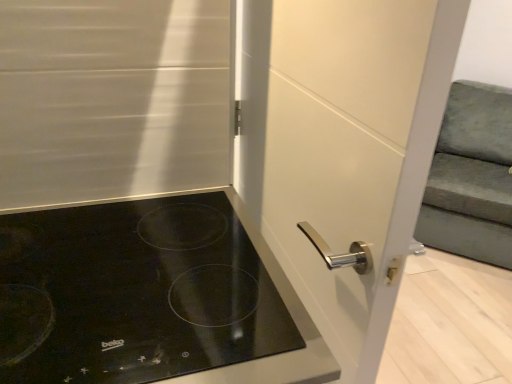
Question: Are white glossy door handle at center and velvet green armchair at right far apart?

Choices:
 (A) no
 (B) yes

Answer: (B)

Question: Considering the relative positions of white glossy door handle at center and velvet green armchair at right in the image provided, is white glossy door handle at center to the right of velvet green armchair at right from the viewer's perspective?

Choices:
 (A) no
 (B) yes

Answer: (A)

Question: Is white glossy door handle at center positioned beyond the bounds of velvet green armchair at right?

Choices:
 (A) no
 (B) yes

Answer: (B)

Question: Is white glossy door handle at center taller than velvet green armchair at right?

Choices:
 (A) no
 (B) yes

Answer: (B)

Question: Does white glossy door handle at center have a larger size compared to velvet green armchair at right?

Choices:
 (A) yes
 (B) no

Answer: (B)

Question: Is point (367, 306) positioned closer to the camera than point (506, 100)?

Choices:
 (A) closer
 (B) farther

Answer: (A)

Question: Is white glossy door handle at center to the left or to the right of velvet green armchair at right in the image?

Choices:
 (A) right
 (B) left

Answer: (B)

Question: From the image's perspective, relative to velvet green armchair at right, is white glossy door handle at center above or below?

Choices:
 (A) below
 (B) above

Answer: (A)

Question: From a real-world perspective, is white glossy door handle at center positioned above or below velvet green armchair at right?

Choices:
 (A) above
 (B) below

Answer: (A)

Question: In terms of size, does white glossy door handle at center appear bigger or smaller than black glass cooktop at lower left?

Choices:
 (A) small
 (B) big

Answer: (B)

Question: From a real-world perspective, is white glossy door handle at center physically located above or below black glass cooktop at lower left?

Choices:
 (A) above
 (B) below

Answer: (A)

Question: Is white glossy door handle at center to the left or to the right of black glass cooktop at lower left in the image?

Choices:
 (A) right
 (B) left

Answer: (A)

Question: Considering their positions, is white glossy door handle at center located in front of or behind black glass cooktop at lower left?

Choices:
 (A) front
 (B) behind

Answer: (B)

Question: Does point (68, 340) appear closer or farther from the camera than point (366, 66)?

Choices:
 (A) closer
 (B) farther

Answer: (B)

Question: In terms of size, does black glass cooktop at lower left appear bigger or smaller than white glossy door handle at center?

Choices:
 (A) small
 (B) big

Answer: (A)